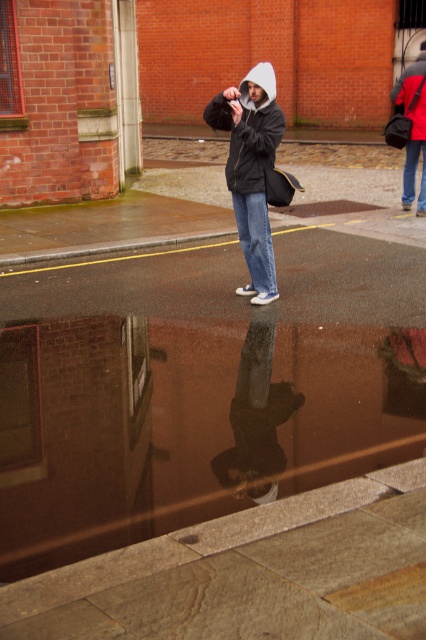
Between denim jeans at center and blue denim jeans at lower right, which one is positioned lower?

denim jeans at center is below.

Can you confirm if denim jeans at center is positioned below blue denim jeans at lower right?

Correct, denim jeans at center is located below blue denim jeans at lower right.

Is point (259, 228) closer to camera compared to point (408, 168)?

Yes, it is.

Where is `denim jeans at center`? This screenshot has width=426, height=640. denim jeans at center is located at coordinates (256, 240).

Between shiny asphalt pavement at center and matte black bag at upper right, which one has less height?

With less height is shiny asphalt pavement at center.

Which is behind, point (141, 262) or point (402, 180)?

The point (402, 180) is more distant.

Is point (187, 248) more distant than point (391, 90)?

No, it is in front of (391, 90).

At what (x,y) coordinates should I click in order to perform the action: click on shiny asphalt pavement at center. Please return your answer as a coordinate pair (x, y). The height and width of the screenshot is (640, 426). Looking at the image, I should click on (201, 388).

Does shiny asphalt pavement at center have a lesser width compared to matte black jacket at center?

Incorrect, shiny asphalt pavement at center's width is not less than matte black jacket at center's.

Which is behind, point (222, 257) or point (250, 186)?

Positioned behind is point (222, 257).

Between point (386, 401) and point (256, 140), which one is positioned in front?

Point (386, 401) is in front.

The width and height of the screenshot is (426, 640). Identify the location of shiny asphalt pavement at center. (201, 388).